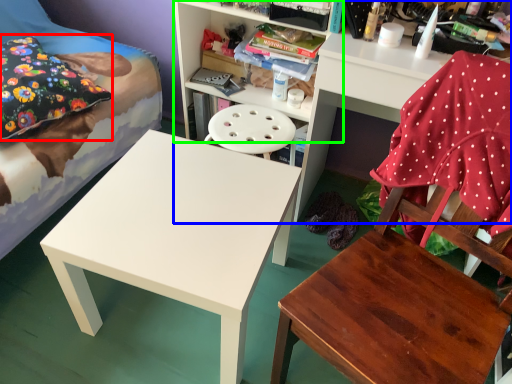
Question: Which object is the closest to the pillow (highlighted by a red box)? Choose among these: shelf (highlighted by a blue box) or shelf (highlighted by a green box).

Choices:
 (A) shelf
 (B) shelf

Answer: (B)